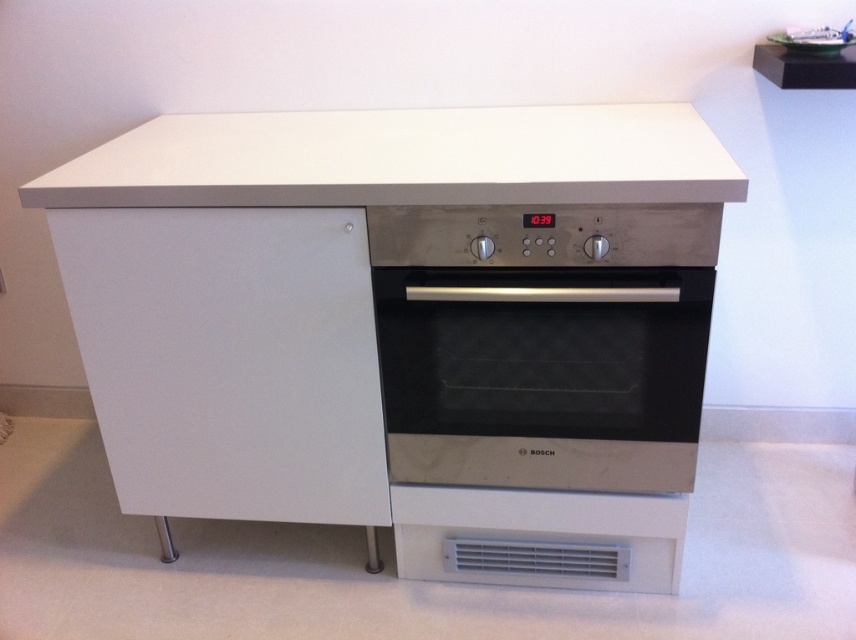
Can you confirm if white matte drawer at left is positioned to the left of white matte countertop at upper center?

Yes, white matte drawer at left is to the left of white matte countertop at upper center.

Is white matte drawer at left in front of white matte countertop at upper center?

No, white matte drawer at left is further to the viewer.

Identify the location of white matte drawer at left. The width and height of the screenshot is (856, 640). (230, 358).

Find the location of a particular element. The width and height of the screenshot is (856, 640). white matte drawer at left is located at coordinates (230, 358).

Does white matte drawer at left have a lesser height compared to stainless steel oven at center?

No, white matte drawer at left is not shorter than stainless steel oven at center.

The image size is (856, 640). I want to click on white matte drawer at left, so click(230, 358).

I want to click on white matte drawer at left, so click(230, 358).

Is stainless steel oven at center positioned in front of white matte countertop at upper center?

No.

Looking at this image, does stainless steel oven at center have a lesser height compared to white matte countertop at upper center?

No.

Between point (598, 371) and point (113, 157), which one is positioned behind?

The point (113, 157) is behind.

This screenshot has width=856, height=640. Identify the location of stainless steel oven at center. (544, 376).